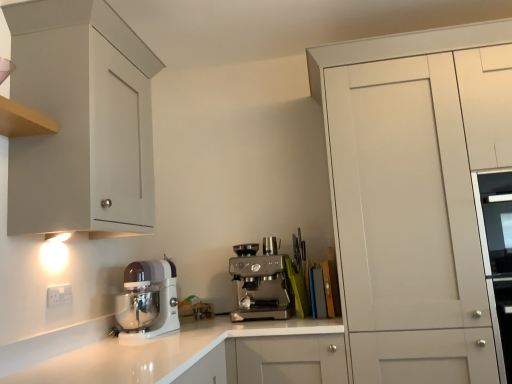
Question: From a real-world perspective, is white matte cabinet at right, the second cabinetry from the left, over white plastic electric outlet at lower left?

Choices:
 (A) yes
 (B) no

Answer: (A)

Question: Does white matte cabinet at right, the first cabinetry in the right-to-left sequence, appear on the right side of white plastic electric outlet at lower left?

Choices:
 (A) yes
 (B) no

Answer: (A)

Question: Can you confirm if white matte cabinet at right, the second cabinetry from the left, is bigger than white plastic electric outlet at lower left?

Choices:
 (A) yes
 (B) no

Answer: (A)

Question: Does white matte cabinet at right, the second cabinetry from the left, have a smaller size compared to white plastic electric outlet at lower left?

Choices:
 (A) no
 (B) yes

Answer: (A)

Question: Can you confirm if white matte cabinet at right, the first cabinetry in the right-to-left sequence, is wider than white plastic electric outlet at lower left?

Choices:
 (A) no
 (B) yes

Answer: (B)

Question: In the image, is matte gray cabinet at upper left, the 2th cabinetry when ordered from right to left, positioned in front of or behind white glossy stand mixer at lower left, which is counted as the first kitchen appliance, starting from the left?

Choices:
 (A) front
 (B) behind

Answer: (A)

Question: Considering the positions of matte gray cabinet at upper left, the 2th cabinetry when ordered from right to left, and white glossy stand mixer at lower left, placed as the 2th kitchen appliance when sorted from right to left, in the image, is matte gray cabinet at upper left, the 2th cabinetry when ordered from right to left, wider or thinner than white glossy stand mixer at lower left, placed as the 2th kitchen appliance when sorted from right to left,?

Choices:
 (A) thin
 (B) wide

Answer: (B)

Question: From a real-world perspective, is matte gray cabinet at upper left, the 2th cabinetry when ordered from right to left, positioned above or below white glossy stand mixer at lower left, which is counted as the first kitchen appliance, starting from the left?

Choices:
 (A) below
 (B) above

Answer: (B)

Question: From their relative heights in the image, would you say matte gray cabinet at upper left, the first cabinetry viewed from the left, is taller or shorter than white glossy stand mixer at lower left, placed as the 2th kitchen appliance when sorted from right to left?

Choices:
 (A) tall
 (B) short

Answer: (A)

Question: From the image's perspective, is white matte cabinet at right, the second cabinetry from the left, positioned above or below satin silver espresso machine at center, which ranks as the second kitchen appliance in left-to-right order?

Choices:
 (A) above
 (B) below

Answer: (A)

Question: In terms of size, does white matte cabinet at right, the first cabinetry in the right-to-left sequence, appear bigger or smaller than satin silver espresso machine at center, which ranks as the second kitchen appliance in left-to-right order?

Choices:
 (A) big
 (B) small

Answer: (A)

Question: Do you think white matte cabinet at right, the first cabinetry in the right-to-left sequence, is within satin silver espresso machine at center, marked as the 1th kitchen appliance in a right-to-left arrangement, or outside of it?

Choices:
 (A) outside
 (B) inside

Answer: (A)

Question: Considering their positions, is white matte cabinet at right, the first cabinetry in the right-to-left sequence, located in front of or behind satin silver espresso machine at center, which ranks as the second kitchen appliance in left-to-right order?

Choices:
 (A) behind
 (B) front

Answer: (B)

Question: Considering the positions of matte gray cabinet at upper left, the first cabinetry viewed from the left, and white plastic electric outlet at lower left in the image, is matte gray cabinet at upper left, the first cabinetry viewed from the left, wider or thinner than white plastic electric outlet at lower left?

Choices:
 (A) wide
 (B) thin

Answer: (A)

Question: From a real-world perspective, is matte gray cabinet at upper left, the first cabinetry viewed from the left, positioned above or below white plastic electric outlet at lower left?

Choices:
 (A) above
 (B) below

Answer: (A)